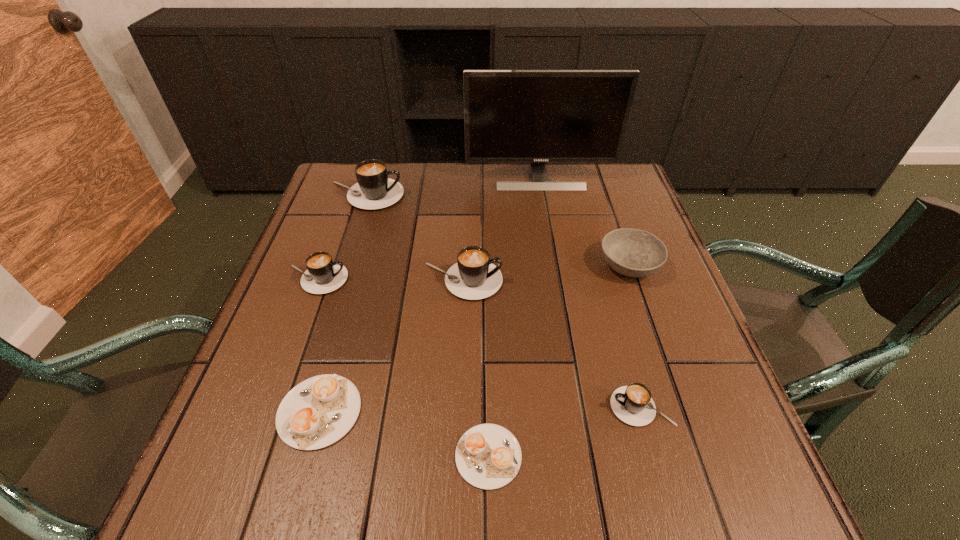
Find the location of a particular element. The image size is (960, 540). vacant space located 0.280m with the handle on the side of the nearest black cappuccino is located at coordinates (452, 407).

You are a GUI agent. You are given a task and a screenshot of the screen. Output one action in this format:
    pyautogui.click(x=<x>, y=<y>)
    Task: Click on the vacant region located 0.090m on the front of the left white cappuccino
    The width and height of the screenshot is (960, 540).
    Given the screenshot: What is the action you would take?
    pyautogui.click(x=292, y=511)

Locate an element on the screen. The height and width of the screenshot is (540, 960). vacant position located 0.330m on the right of the right white cappuccino is located at coordinates (724, 456).

Where is `monitor situated at the far edge`? This screenshot has height=540, width=960. monitor situated at the far edge is located at coordinates (537, 116).

Where is `cappuccino located at the far edge`? Image resolution: width=960 pixels, height=540 pixels. cappuccino located at the far edge is located at coordinates tap(374, 190).

Identify the location of object present at the near edge. This screenshot has height=540, width=960. (488, 456).

The height and width of the screenshot is (540, 960). Identify the location of monitor that is positioned at the right edge. (537, 116).

Where is `bowl that is positioned at the right edge`? bowl that is positioned at the right edge is located at coordinates (631, 252).

Where is `cappuccino that is positioned at the right edge`? cappuccino that is positioned at the right edge is located at coordinates (632, 404).

Find the location of `object situated at the far left corner`. object situated at the far left corner is located at coordinates (374, 190).